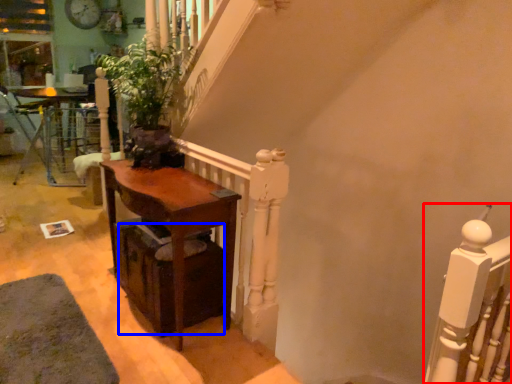
Question: Which object is closer to the camera taking this photo, rail (highlighted by a red box) or drawer (highlighted by a blue box)?

Choices:
 (A) rail
 (B) drawer

Answer: (A)